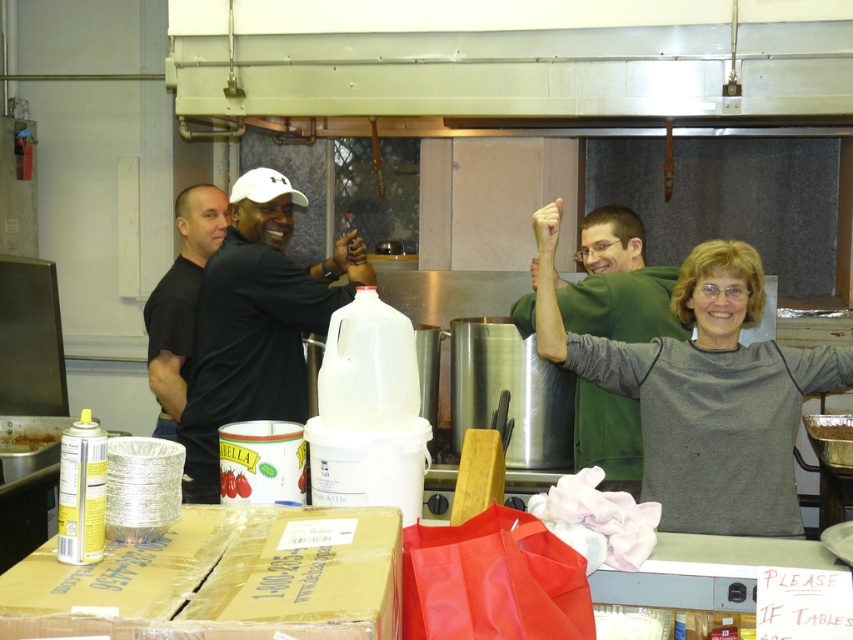
Can you confirm if black matte shirt at center is positioned to the left of smooth skin hand at upper right?

Correct, you'll find black matte shirt at center to the left of smooth skin hand at upper right.

Does point (212, 460) come behind point (535, 280)?

No.

Find the location of `black matte shirt at center`. black matte shirt at center is located at coordinates (253, 324).

Does black matte shirt at center have a lesser width compared to green matte shirt at center?

In fact, black matte shirt at center might be wider than green matte shirt at center.

Is point (289, 406) positioned in front of point (521, 310)?

Yes.

Does point (212, 412) come closer to viewer compared to point (631, 332)?

Yes, it is.

Locate an element on the screen. black matte shirt at center is located at coordinates (253, 324).

Between green matte shirt at center and shiny aluminum foil at lower left, which one has more height?

green matte shirt at center

Does green matte shirt at center have a greater width compared to shiny aluminum foil at lower left?

Correct, the width of green matte shirt at center exceeds that of shiny aluminum foil at lower left.

Is point (680, 324) positioned in front of point (45, 438)?

Yes, it is.

You are a GUI agent. You are given a task and a screenshot of the screen. Output one action in this format:
    pyautogui.click(x=<x>, y=<y>)
    Task: Click on the green matte shirt at center
    Image resolution: width=853 pixels, height=640 pixels.
    Given the screenshot: What is the action you would take?
    pyautogui.click(x=606, y=285)